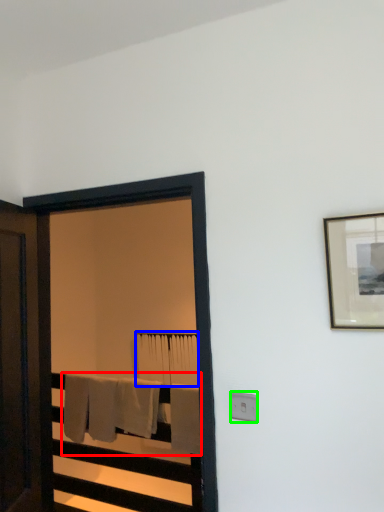
Question: Which is nearer to the bath towel (highlighted by a red box)? bath towel (highlighted by a blue box) or electric outlet (highlighted by a green box).

Choices:
 (A) bath towel
 (B) electric outlet

Answer: (A)